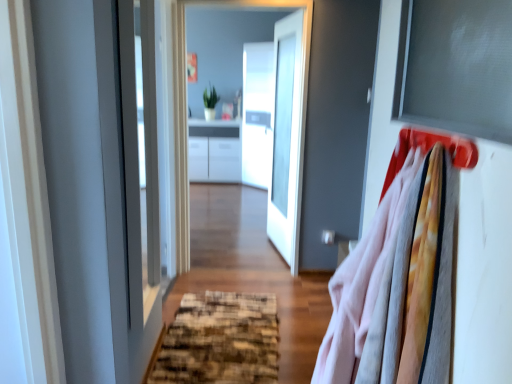
Question: Is matte gray window screen at upper right wider or thinner than textured brown doormat at center?

Choices:
 (A) thin
 (B) wide

Answer: (A)

Question: In terms of height, does matte gray window screen at upper right look taller or shorter compared to textured brown doormat at center?

Choices:
 (A) tall
 (B) short

Answer: (A)

Question: Considering the real-world distances, which object is closest to the soft cotton shirts at right?

Choices:
 (A) white glossy door at center
 (B) textured brown doormat at center
 (C) matte gray window screen at upper right
 (D) matte plastic hanger at upper right
 (E) transparent glass door at center

Answer: (D)

Question: Which object is positioned farthest from the matte gray window screen at upper right?

Choices:
 (A) transparent glass door at center
 (B) transparent glass door at center
 (C) textured brown doormat at center
 (D) white glossy door at center
 (E) soft cotton shirts at right

Answer: (D)